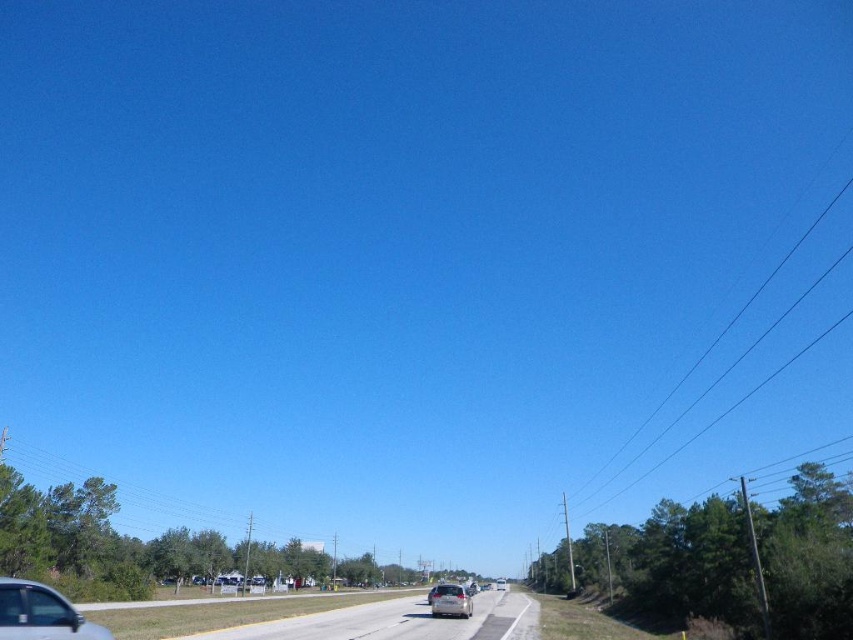
Is silver metallic car at lower left thinner than satin silver sedan at center?

No.

Is silver metallic car at lower left to the left of satin silver sedan at center from the viewer's perspective?

Indeed, silver metallic car at lower left is positioned on the left side of satin silver sedan at center.

This screenshot has width=853, height=640. I want to click on silver metallic car at lower left, so click(x=41, y=612).

Is the position of gray asphalt highway at center less distant than that of satin silver sedan at center?

Yes, it is in front of satin silver sedan at center.

Can you confirm if gray asphalt highway at center is positioned to the left of satin silver sedan at center?

Correct, you'll find gray asphalt highway at center to the left of satin silver sedan at center.

Measure the distance between point (405,598) and camera.

The distance of point (405,598) from camera is 298.20 meters.

Identify the location of gray asphalt highway at center. (398, 621).

Between gray asphalt highway at center and silver metallic car at lower left, which one has less height?

silver metallic car at lower left

You are a GUI agent. You are given a task and a screenshot of the screen. Output one action in this format:
    pyautogui.click(x=<x>, y=<y>)
    Task: Click on the gray asphalt highway at center
    The width and height of the screenshot is (853, 640).
    Given the screenshot: What is the action you would take?
    pyautogui.click(x=398, y=621)

Does point (399, 612) lie behind point (55, 618)?

Yes.

At what (x,y) coordinates should I click in order to perform the action: click on gray asphalt highway at center. Please return your answer as a coordinate pair (x, y). Image resolution: width=853 pixels, height=640 pixels. Looking at the image, I should click on (398, 621).